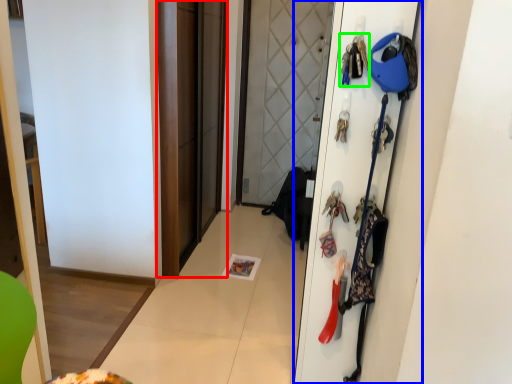
Question: Which object is positioned farthest from screen door (highlighted by a red box)? Select from door (highlighted by a blue box) and accessory (highlighted by a green box).

Choices:
 (A) door
 (B) accessory

Answer: (B)